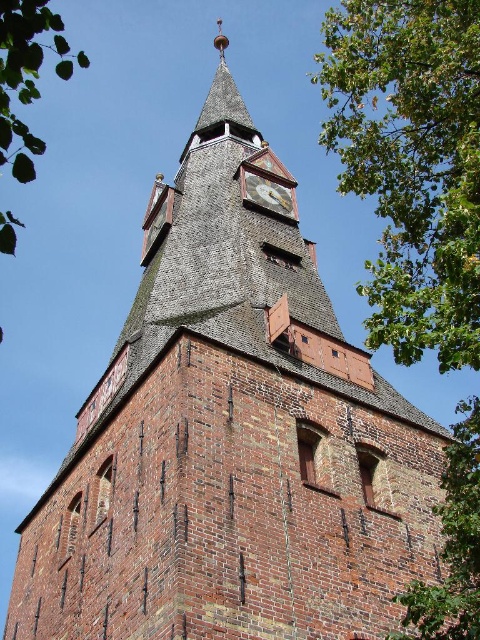
Question: Considering the relative positions of green leafy tree at upper left and gold metallic clock at center in the image provided, where is green leafy tree at upper left located with respect to gold metallic clock at center?

Choices:
 (A) below
 (B) above

Answer: (B)

Question: Is the position of green leafy tree at upper left more distant than that of gold metallic clock at center?

Choices:
 (A) yes
 (B) no

Answer: (B)

Question: Which point appears closest to the camera in this image?

Choices:
 (A) (444, 84)
 (B) (3, 72)
 (C) (255, 188)

Answer: (B)

Question: Which of the following is the closest to the observer?

Choices:
 (A) gold metallic clock at center
 (B) green leafy tree at upper left
 (C) green leafy tree at upper right

Answer: (B)

Question: Is green leafy tree at upper right to the right of gold metallic clock at center from the viewer's perspective?

Choices:
 (A) no
 (B) yes

Answer: (B)

Question: Which point is closer to the camera?

Choices:
 (A) gold metallic clock at center
 (B) green leafy tree at upper right

Answer: (B)